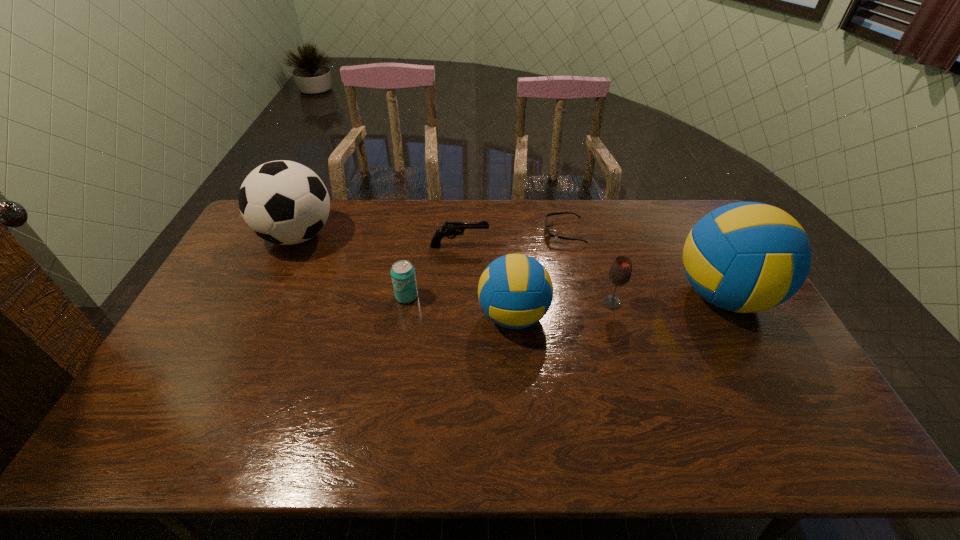
At what (x,y) coordinates should I click in order to perform the action: click on vacant space in between the fourth tallest object and the fifth shortest object. Please return your answer as a coordinate pair (x, y). Looking at the image, I should click on (563, 309).

Find the location of `unoccupied area between the soccer ball and the sixth object from right to left`. unoccupied area between the soccer ball and the sixth object from right to left is located at coordinates click(352, 266).

Identify the location of vacant point located between the sunglasses and the gun. (512, 239).

Locate an element on the screen. This screenshot has width=960, height=540. object that ranks as the fourth closest to the shortest object is located at coordinates (620, 272).

Select which object appears as the second closest to the glass drink container. Please provide its 2D coordinates. Your answer should be formatted as a tuple, i.e. [(x, y)], where the tuple contains the x and y coordinates of a point satisfying the conditions above.

[(515, 291)]

Find the location of a particular element. vacant region that satisfies the following two spatial constraints: 1. on the front-facing side of the sunglasses; 2. on the back side of the taller volleyball is located at coordinates (579, 295).

At what (x,y) coordinates should I click in order to perform the action: click on free space in the image that satisfies the following two spatial constraints: 1. on the back side of the shorter volleyball; 2. at the end of the barrel of the gun. Please return your answer as a coordinate pair (x, y). This screenshot has height=540, width=960. Looking at the image, I should click on (509, 246).

Where is `vacant space that satisfies the following two spatial constraints: 1. on the front side of the second object from left to right; 2. on the right side of the glass drink container`? vacant space that satisfies the following two spatial constraints: 1. on the front side of the second object from left to right; 2. on the right side of the glass drink container is located at coordinates (405, 302).